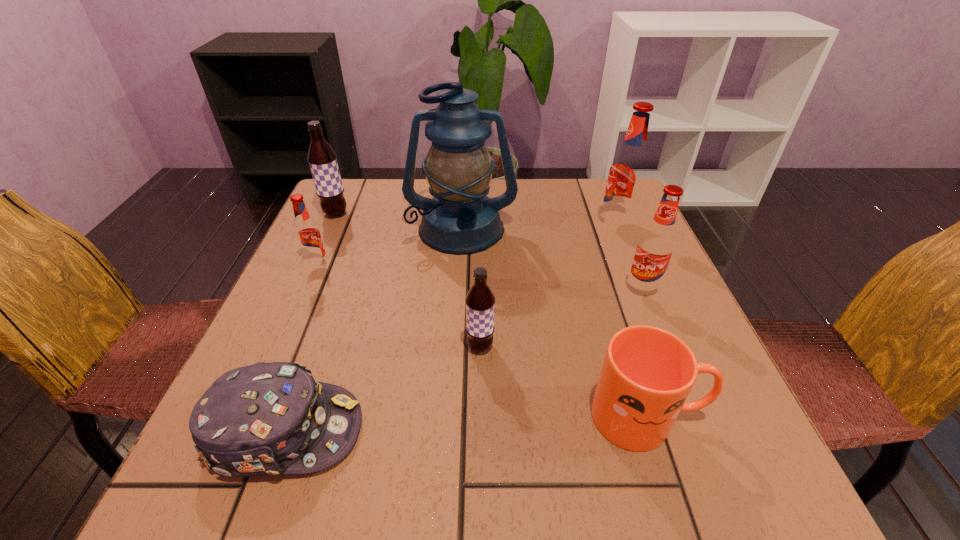
Find the location of `object that is at the near right corner`. object that is at the near right corner is located at coordinates (647, 374).

Where is `free space at the near edge of the desktop`? The image size is (960, 540). free space at the near edge of the desktop is located at coordinates (560, 482).

Where is `vacant point at the left edge`? vacant point at the left edge is located at coordinates (298, 261).

Where is `vacant space at the right edge of the desktop`? This screenshot has height=540, width=960. vacant space at the right edge of the desktop is located at coordinates (616, 238).

In the image, there is a desktop. In order to click on vacant space at the far left corner in this screenshot , I will do `click(363, 222)`.

The height and width of the screenshot is (540, 960). What are the coordinates of `vacant space at the near left corner` in the screenshot? It's located at (266, 491).

In the image, there is a desktop. Identify the location of vacant space at the far right corner. (589, 209).

In the image, there is a desktop. Identify the location of vacant space at the near right corner. The height and width of the screenshot is (540, 960). (728, 468).

Locate an element on the screen. This screenshot has width=960, height=540. unoccupied area between the left brown root beer and the nearest red root beer is located at coordinates (489, 252).

Where is `empty space that is in between the leftmost red root beer and the headwear`? The height and width of the screenshot is (540, 960). empty space that is in between the leftmost red root beer and the headwear is located at coordinates (301, 349).